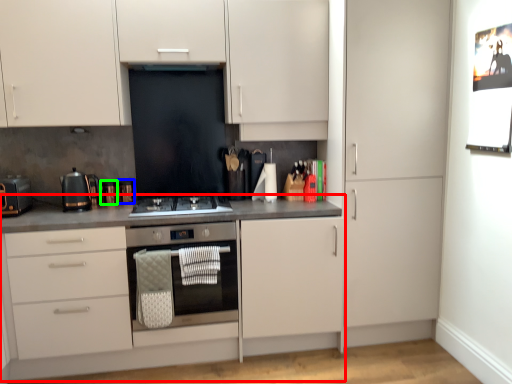
Question: Which object is positioned farthest from countertop (highlighted by a red box)? Select from appliance (highlighted by a blue box) and appliance (highlighted by a green box).

Choices:
 (A) appliance
 (B) appliance

Answer: (B)